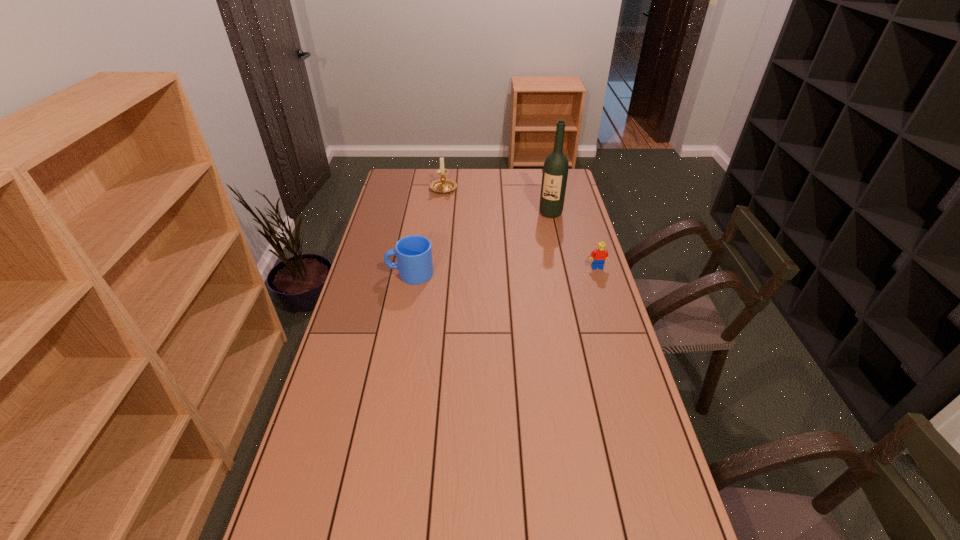
The width and height of the screenshot is (960, 540). I want to click on free spot on the desktop that is between the mug and the Lego and is positioned with a handle on the side of the third shortest object, so click(530, 269).

Locate an element on the screen. free spot on the desktop that is between the mug and the Lego and is positioned on the labeled side of the wine bottle is located at coordinates (524, 270).